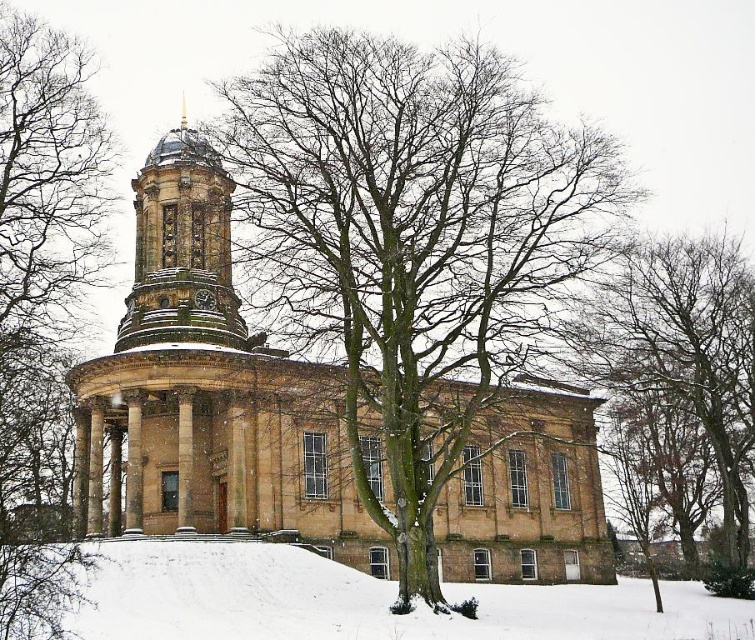
Question: Which object appears closest to the camera in this image?

Choices:
 (A) white powdery snow at lower center
 (B) bare branches at left
 (C) bare branches at right

Answer: (B)

Question: Estimate the real-world distances between objects in this image. Which object is closer to the bare branches at right?

Choices:
 (A) bare branches at left
 (B) white powdery snow at lower center
 (C) bare branches at center

Answer: (C)

Question: Considering the real-world distances, which object is closest to the bare branches at right?

Choices:
 (A) bare branches at left
 (B) bare branches at center
 (C) white powdery snow at lower center

Answer: (B)

Question: Is bare branches at right bigger than golden stone clock tower at center?

Choices:
 (A) no
 (B) yes

Answer: (B)

Question: Observing the image, what is the correct spatial positioning of bare branches at center in reference to bare branches at left?

Choices:
 (A) below
 (B) above

Answer: (B)

Question: Can you confirm if bare branches at left is positioned above bare branches at right?

Choices:
 (A) no
 (B) yes

Answer: (B)